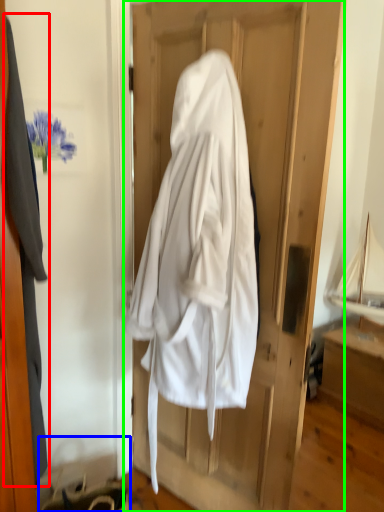
Question: Estimate the real-world distances between objects in this image. Which object is closer to garment (highlighted by a red box), hanger (highlighted by a blue box) or door (highlighted by a green box)?

Choices:
 (A) hanger
 (B) door

Answer: (A)